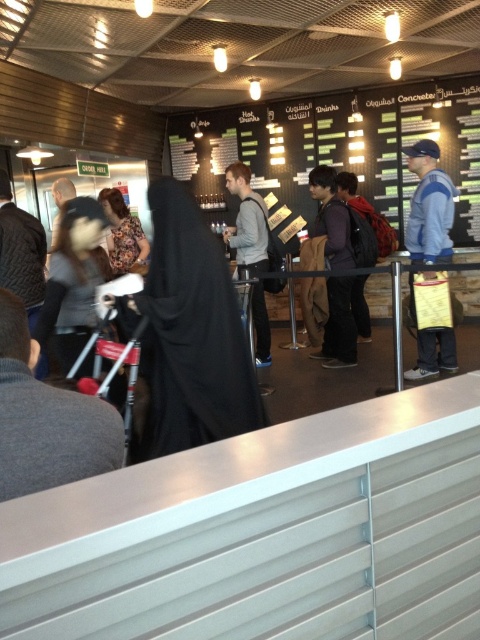
Question: Which object appears farthest from the camera in this image?

Choices:
 (A) floral-patterned fabric at center
 (B) black matte abaya at center

Answer: (A)

Question: Observing the image, what is the correct spatial positioning of black matte abaya at center in reference to floral-patterned fabric at center?

Choices:
 (A) left
 (B) right

Answer: (B)

Question: Which object appears closest to the camera in this image?

Choices:
 (A) black matte abaya at center
 (B) floral-patterned fabric at center

Answer: (A)

Question: Does black matte abaya at center have a larger size compared to floral-patterned fabric at center?

Choices:
 (A) no
 (B) yes

Answer: (B)

Question: Does black matte abaya at center have a lesser width compared to floral-patterned fabric at center?

Choices:
 (A) yes
 (B) no

Answer: (B)